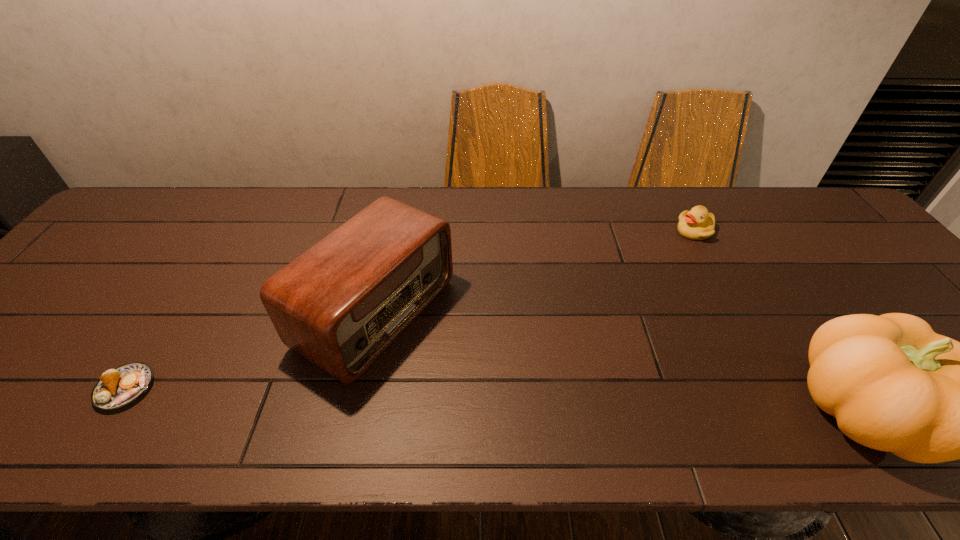
Image resolution: width=960 pixels, height=540 pixels. I want to click on the leftmost object, so click(118, 387).

Where is `pastry`? The width and height of the screenshot is (960, 540). pastry is located at coordinates (118, 387).

Locate an element on the screen. Image resolution: width=960 pixels, height=540 pixels. the farthest object is located at coordinates (697, 224).

Locate an element on the screen. This screenshot has height=540, width=960. duckling is located at coordinates coord(697,224).

What are the coordinates of `radio receiver` in the screenshot? It's located at (343, 302).

Where is `vacant space situated 0.320m on the right of the leftmost object`? vacant space situated 0.320m on the right of the leftmost object is located at coordinates (304, 389).

Image resolution: width=960 pixels, height=540 pixels. Identify the location of vacant space located 0.240m on the front-facing side of the farthest object. (647, 284).

You are a GUI agent. You are given a task and a screenshot of the screen. Output one action in this format:
    pyautogui.click(x=<x>, y=<y>)
    Task: Click on the vacant region located 0.130m on the front-facing side of the farthest object
    
    Given the screenshot: What is the action you would take?
    pyautogui.click(x=666, y=263)

Where is `vacant space situated on the front-facing side of the farthest object`? This screenshot has height=540, width=960. vacant space situated on the front-facing side of the farthest object is located at coordinates (626, 308).

Identify the location of vacant area located 0.150m on the front panel of the second object from left to right. (493, 382).